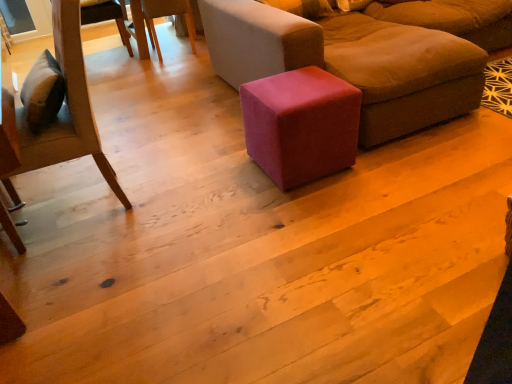
At what (x,y) coordinates should I click in order to perform the action: click on free spot in front of velvet pink cube at center. Please return your answer as a coordinate pair (x, y). The height and width of the screenshot is (384, 512). Looking at the image, I should click on (333, 204).